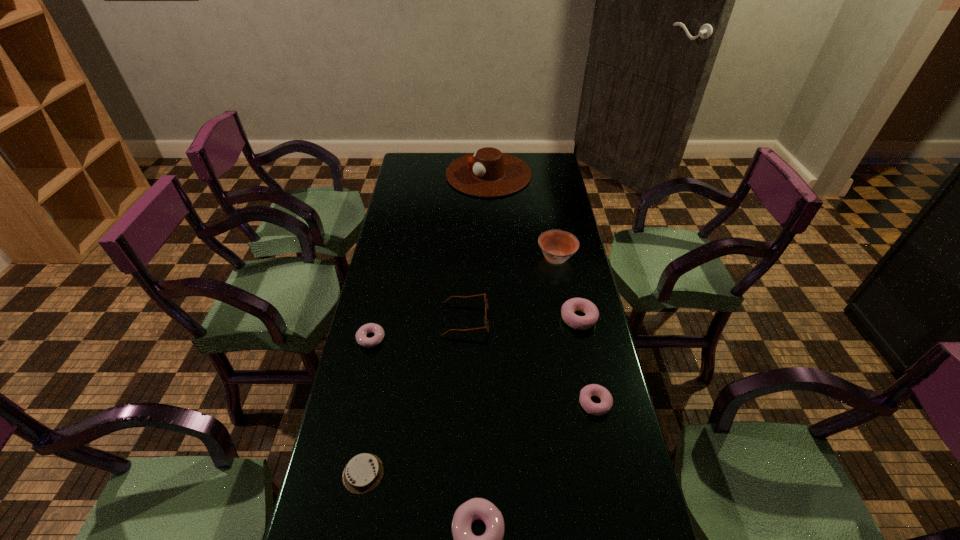
In the image, there is a desktop. Where is `free region at the far right corner`? free region at the far right corner is located at coordinates tap(531, 168).

This screenshot has height=540, width=960. What are the coordinates of `vacant area that lies between the bigger pink doughnut and the tallest object` in the screenshot? It's located at (534, 246).

Identify the location of free area in between the leftmost doughnut and the second nearest object. (367, 406).

Identify the location of vacant region between the chocolate cake and the farther pink doughnut. Image resolution: width=960 pixels, height=540 pixels. (471, 396).

I want to click on vacant region between the leftmost doughnut and the sixth farthest object, so click(x=483, y=371).

Identify the location of vacant point located between the second farthest object and the bigger pink doughnut. The height and width of the screenshot is (540, 960). point(567,288).

The width and height of the screenshot is (960, 540). What are the coordinates of `free point between the shortest object and the bigger pink doughnut` in the screenshot? It's located at (471, 396).

Identify which object is located as the fifth nearest to the spectacles. Please provide its 2D coordinates. Your answer should be formatted as a tuple, i.e. [(x, y)], where the tuple contains the x and y coordinates of a point satisfying the conditions above.

[(363, 472)]

At what (x,y) coordinates should I click in order to perform the action: click on object that stands as the fifth closest to the sixth farthest object. Please return your answer as a coordinate pair (x, y). The height and width of the screenshot is (540, 960). Looking at the image, I should click on (363, 472).

At what (x,y) coordinates should I click in order to perform the action: click on doughnut that stands as the second closest to the shortest object. Please return your answer as a coordinate pair (x, y). The width and height of the screenshot is (960, 540). Looking at the image, I should click on (361, 335).